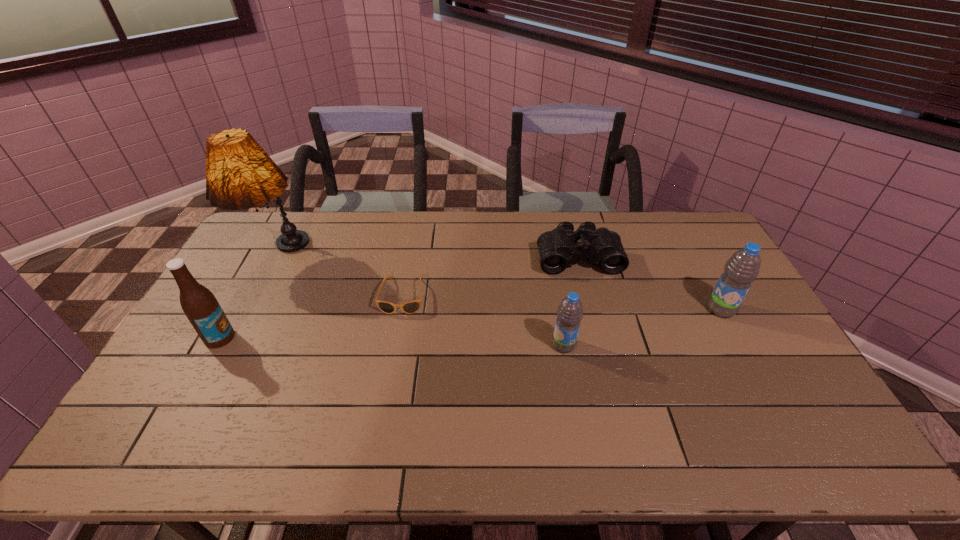
Where is `object at the far left corner`? object at the far left corner is located at coordinates (239, 174).

You are a GUI agent. You are given a task and a screenshot of the screen. Output one action in this format:
    pyautogui.click(x=<x>, y=<y>)
    Task: Click on the free space at the far edge of the desktop
    
    Given the screenshot: What is the action you would take?
    pyautogui.click(x=495, y=219)

Image resolution: width=960 pixels, height=540 pixels. What are the coordinates of `vacant space at the far left corner` in the screenshot? It's located at click(x=270, y=227).

This screenshot has width=960, height=540. What are the coordinates of `free space at the near right corner of the desktop` in the screenshot? It's located at (788, 397).

You are a GUI agent. You are given a task and a screenshot of the screen. Output one action in this format:
    pyautogui.click(x=<x>, y=<y>)
    Task: Click on the empty space that is in between the binoculars and the beer bottle
    
    Given the screenshot: What is the action you would take?
    pyautogui.click(x=399, y=298)

Where is `vacant area between the fourth object from right to left and the tallest object`? vacant area between the fourth object from right to left and the tallest object is located at coordinates (341, 276).

You are a GUI agent. You are given a task and a screenshot of the screen. Output one action in this format:
    pyautogui.click(x=<x>, y=<y>)
    Task: Click on the vacant area that lies between the lampshade and the binoculars
    
    Given the screenshot: What is the action you would take?
    pyautogui.click(x=428, y=257)

In order to click on vacant area that lies between the beer bottle and the shortest object in this screenshot , I will do `click(311, 317)`.

Locate an element on the screen. vacant space that is in between the sunglasses and the nearer water bottle is located at coordinates (483, 320).

Where is `free space between the binoculars and the sunglasses`? free space between the binoculars and the sunglasses is located at coordinates (491, 276).